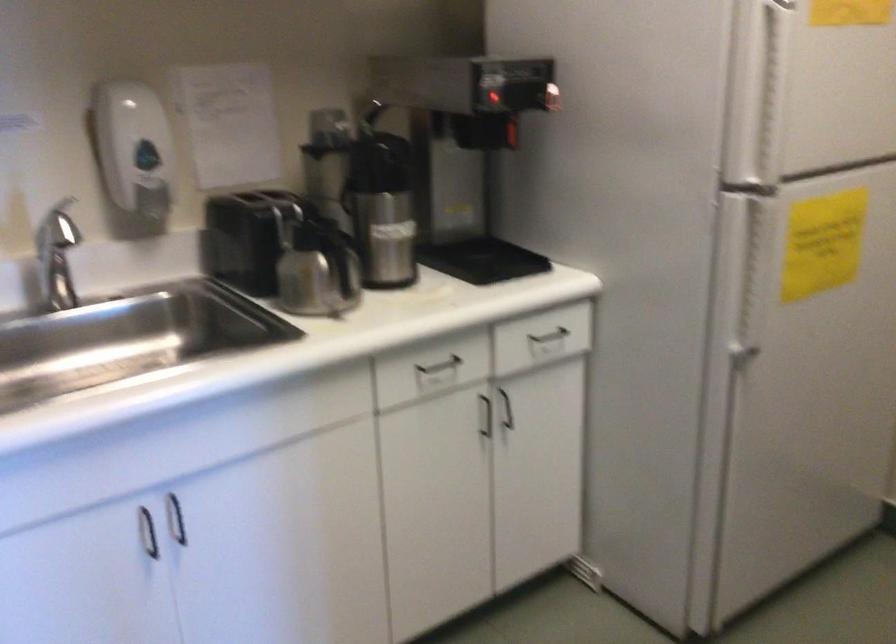
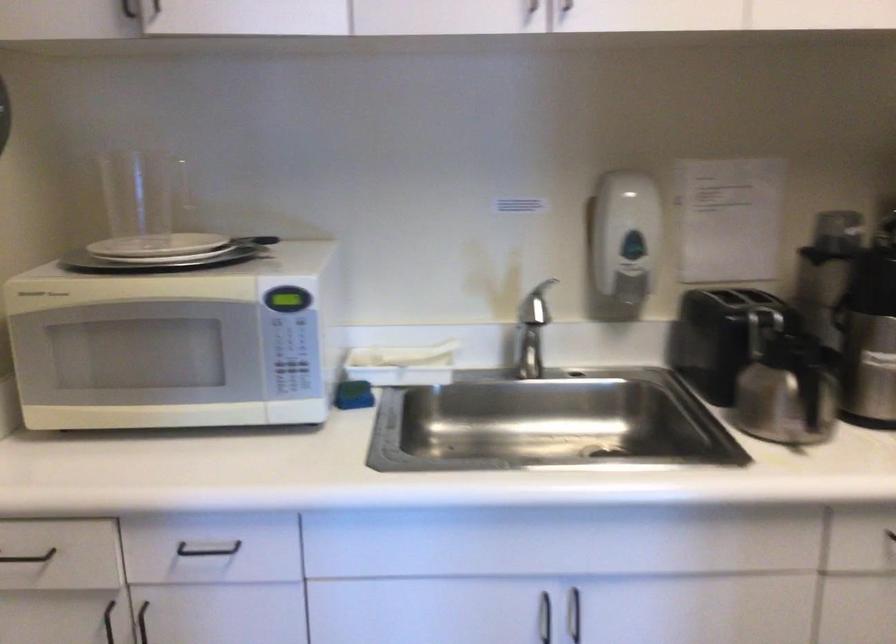
Find the pixel in the second image that matches point 143,526 in the first image.

(544, 618)